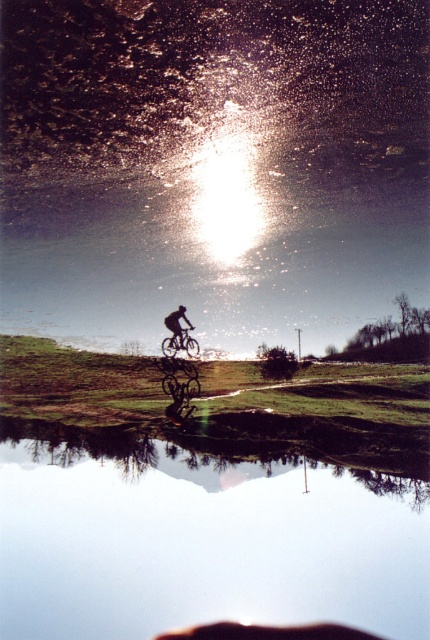
Question: Does shiny metallic bicycle at center have a lesser width compared to black matte bicycle at center?

Choices:
 (A) yes
 (B) no

Answer: (B)

Question: Which is farther from the black matte bicycle at center?

Choices:
 (A) shiny metallic bicycle at center
 (B) transparent glass water at center

Answer: (B)

Question: Estimate the real-world distances between objects in this image. Which object is closer to the black matte bicycle at center?

Choices:
 (A) shiny metallic bicycle at center
 (B) transparent glass water at center

Answer: (A)

Question: Can you confirm if transparent glass water at center is thinner than shiny metallic bicycle at center?

Choices:
 (A) no
 (B) yes

Answer: (A)

Question: Which object appears farthest from the camera in this image?

Choices:
 (A) shiny metallic bicycle at center
 (B) black matte bicycle at center
 (C) transparent glass water at center

Answer: (C)

Question: Is transparent glass water at center wider than black matte bicycle at center?

Choices:
 (A) yes
 (B) no

Answer: (A)